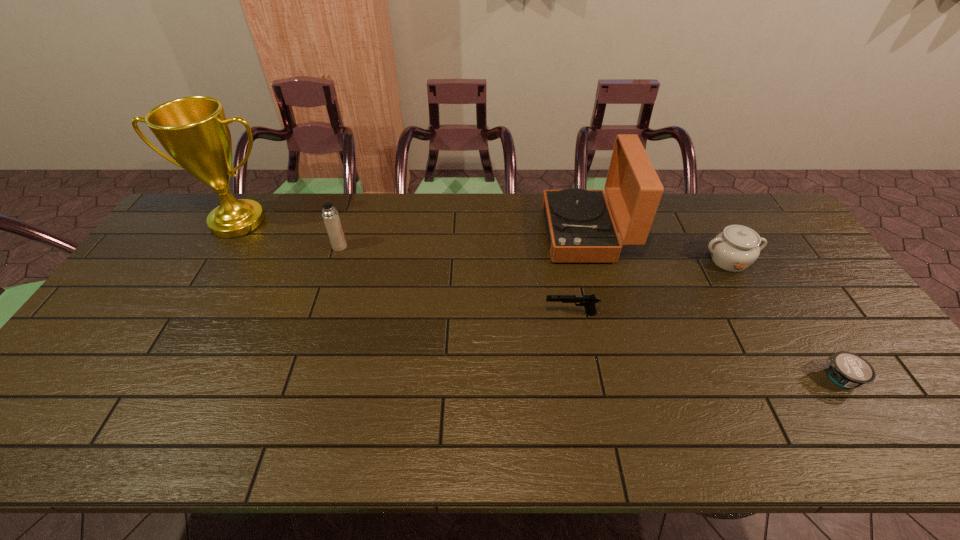
The width and height of the screenshot is (960, 540). Find the location of `award that is positioned at the far edge`. award that is positioned at the far edge is located at coordinates (194, 131).

Identify the location of phonograph record present at the far edge. The height and width of the screenshot is (540, 960). (579, 224).

At what (x,y) coordinates should I click in order to perform the action: click on object that is positioned at the left edge. Please return your answer as a coordinate pair (x, y). The height and width of the screenshot is (540, 960). Looking at the image, I should click on (194, 131).

The image size is (960, 540). Identify the location of object situated at the right edge. (846, 369).

Where is `object that is at the far left corner`? object that is at the far left corner is located at coordinates (194, 131).

This screenshot has width=960, height=540. In the image, there is a desktop. What are the coordinates of `vacant space at the far edge` in the screenshot? It's located at (348, 197).

In order to click on vacant space at the near edge of the desktop in this screenshot , I will do `click(173, 443)`.

The height and width of the screenshot is (540, 960). Identify the location of vacant space at the left edge of the desktop. (204, 239).

What are the coordinates of `free region at the near left corner of the desktop` in the screenshot? It's located at (46, 443).

Locate an element on the screen. free space at the far right corner of the desktop is located at coordinates (736, 212).